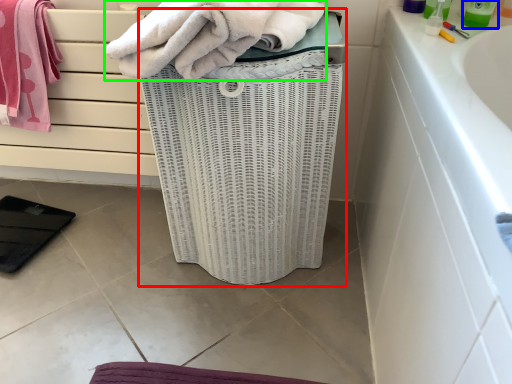
Question: Which is farther away from basket container (highlighted by a red box)? cleaning product (highlighted by a blue box) or towel (highlighted by a green box)?

Choices:
 (A) cleaning product
 (B) towel

Answer: (A)